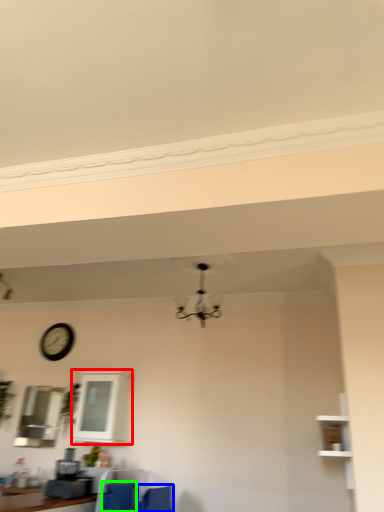
Question: Which is nearer to the window (highlighted by a red box)? armchair (highlighted by a blue box) or feeding chair (highlighted by a green box).

Choices:
 (A) armchair
 (B) feeding chair

Answer: (B)